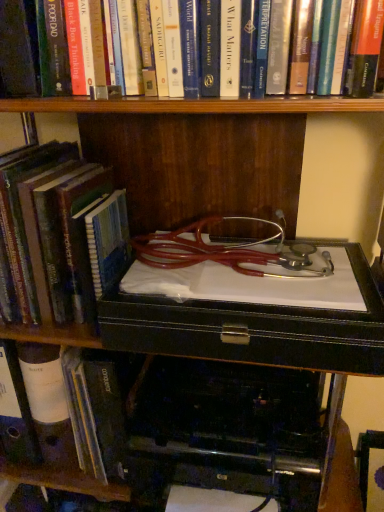
Question: Considering their positions, is hardcover book at left, the 3th book viewed from the top, located in front of or behind black plastic printer at lower center?

Choices:
 (A) front
 (B) behind

Answer: (B)

Question: Considering the positions of hardcover book at left, the 3th book viewed from the top, and black plastic printer at lower center in the image, is hardcover book at left, the 3th book viewed from the top, bigger or smaller than black plastic printer at lower center?

Choices:
 (A) small
 (B) big

Answer: (A)

Question: Considering the real-world distances, which object is closest to the hardcover book at left, the 3th book viewed from the top?

Choices:
 (A) hardcover book at left, marked as the 2th book in a bottom-to-top arrangement
 (B) hardcover book at upper center, which is the 1th book in top-to-bottom order
 (C) black plastic printer at lower center

Answer: (A)

Question: Estimate the real-world distances between objects in this image. Which object is farther from the hardcover book at upper center, the 3th book from the bottom?

Choices:
 (A) hardcover book at left, which is counted as the second book, starting from the top
 (B) black plastic printer at lower center
 (C) hardcover book at left, which is the 1th book from bottom to top

Answer: (C)